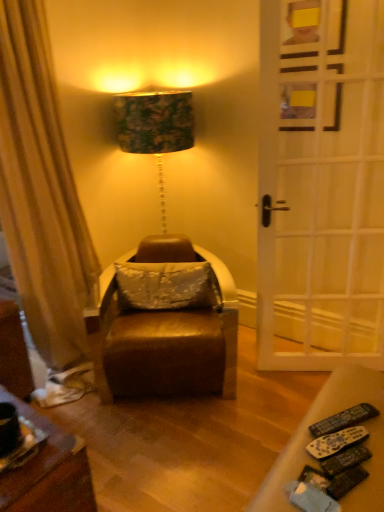
Question: Do you think leather swivel chair at center is within black plastic remote control at lower right, which is the 2th remote control from back to front, or outside of it?

Choices:
 (A) outside
 (B) inside

Answer: (A)

Question: From their relative heights in the image, would you say leather swivel chair at center is taller or shorter than black plastic remote control at lower right, which is the 2th remote control from back to front?

Choices:
 (A) tall
 (B) short

Answer: (A)

Question: Estimate the real-world distances between objects in this image. Which object is closer to the black plastic remote control at lower right, the 1th remote control when ordered from back to front?

Choices:
 (A) black plastic remote control at lower right, arranged as the first remote control when viewed from the front
 (B) white wooden door at right
 (C) leather swivel chair at center
 (D) satin white pillow at center

Answer: (A)

Question: Which object is positioned farthest from the black plastic remote control at lower right, arranged as the first remote control when viewed from the front?

Choices:
 (A) leather swivel chair at center
 (B) black plastic remote control at lower right, the 1th remote control when ordered from back to front
 (C) satin white pillow at center
 (D) white wooden door at right

Answer: (D)